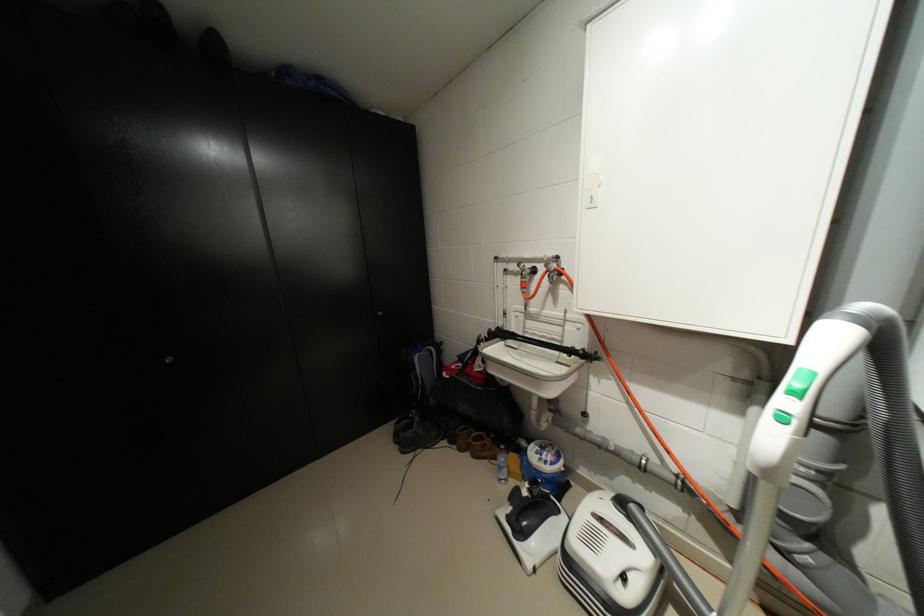
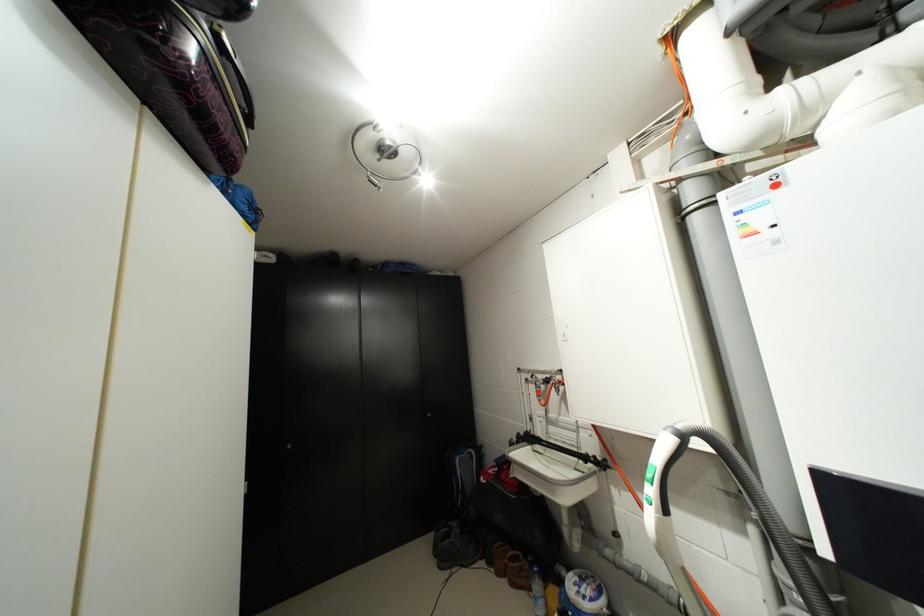
Locate, in the second image, the point that corresponds to (536,272) in the first image.

(549, 383)